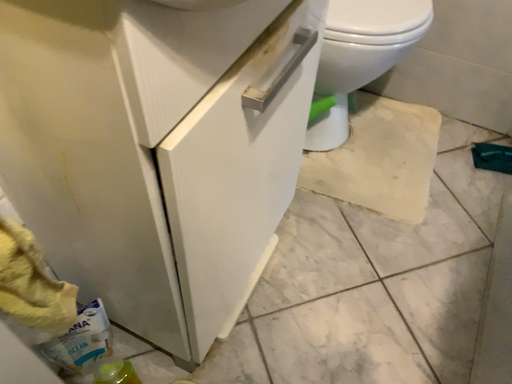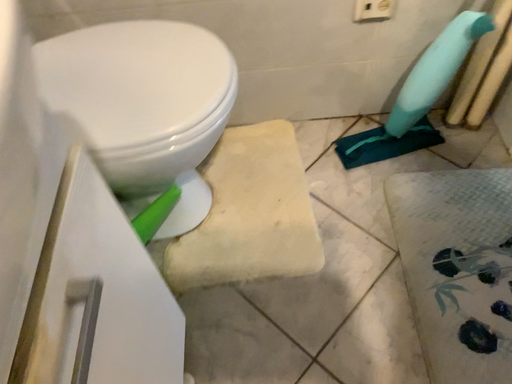
Question: How did the camera likely rotate when shooting the video?

Choices:
 (A) rotated right
 (B) rotated left

Answer: (A)